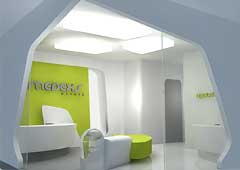
Identify the location of blurry logo on wall. (47, 87).